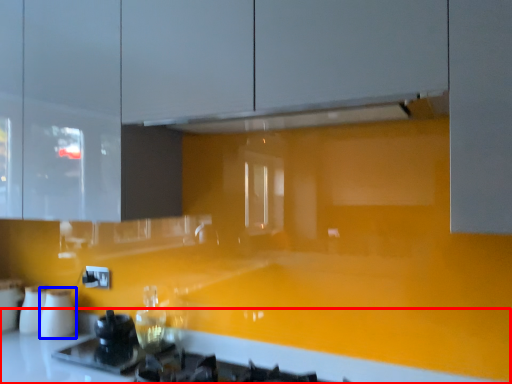
Question: Which point is closer to the camera, counter top (highlighted by a red box) or appliance (highlighted by a blue box)?

Choices:
 (A) counter top
 (B) appliance

Answer: (A)